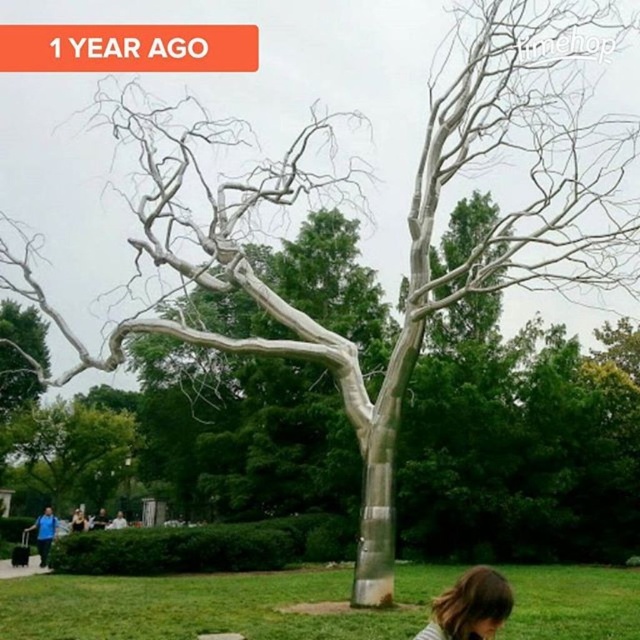
You are an artist planning to paint the scene. You need to decide which object to focus on first based on their size. According to the description, which object should you paint first, the silver metallic tree at center or the matte black hair at lower center?

The silver metallic tree at center occupies less space than the matte black hair at lower center, so you should paint the matte black hair at lower center first as it is larger and might require more attention due to its size.

You are a photographer planning to capture a time lapse of the silver metallic tree at center and the brown hair at lower center. Based on their sizes, which object should you focus on first to ensure both fit in the frame?

The silver metallic tree at center has a smaller size compared to brown hair at lower center, so you should focus on the silver metallic tree at center first to ensure both fit in the frame.